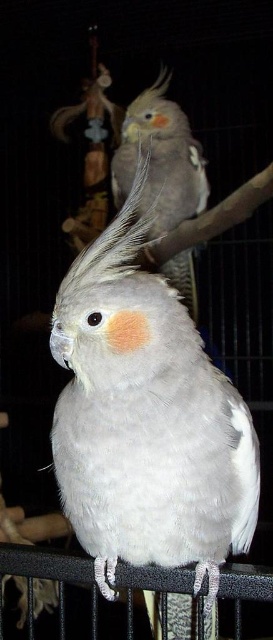
Question: Among these points, which one is farthest from the camera?

Choices:
 (A) (140, 97)
 (B) (196, 342)

Answer: (A)

Question: Is white feathered parrot at center positioned at the back of gray feathered parrot at upper center?

Choices:
 (A) no
 (B) yes

Answer: (A)

Question: Which point is closer to the camera?

Choices:
 (A) (146, 454)
 (B) (158, 131)

Answer: (A)

Question: Which of the following is the farthest from the observer?

Choices:
 (A) (174, 412)
 (B) (111, 163)

Answer: (B)

Question: Is white feathered parrot at center further to the viewer compared to gray feathered parrot at upper center?

Choices:
 (A) yes
 (B) no

Answer: (B)

Question: Can you confirm if white feathered parrot at center is positioned to the left of gray feathered parrot at upper center?

Choices:
 (A) yes
 (B) no

Answer: (A)